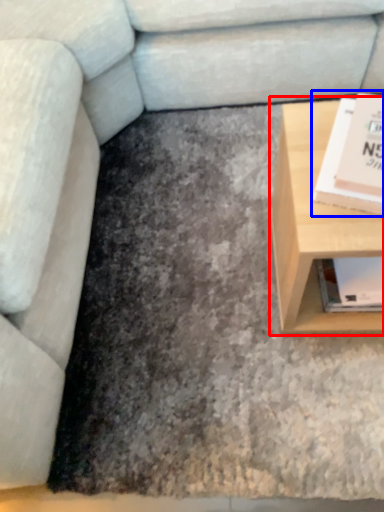
Question: Which object is closer to the camera taking this photo, table (highlighted by a red box) or paperback book (highlighted by a blue box)?

Choices:
 (A) table
 (B) paperback book

Answer: (B)